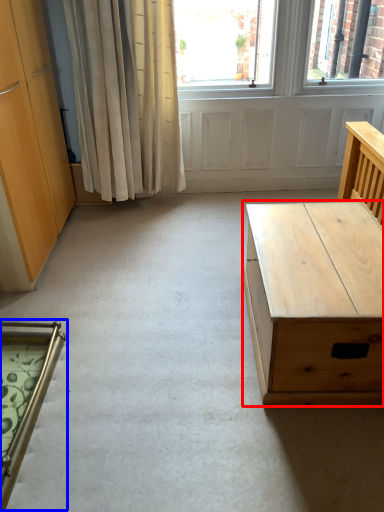
Question: Among these objects, which one is farthest to the camera, desk (highlighted by a red box) or chair (highlighted by a blue box)?

Choices:
 (A) desk
 (B) chair

Answer: (A)